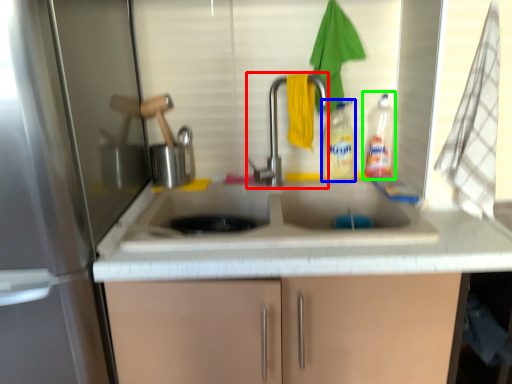
Question: Which object is positioned closest to tap (highlighted by a red box)? Select from bottle (highlighted by a blue box) and bottle (highlighted by a green box).

Choices:
 (A) bottle
 (B) bottle

Answer: (A)